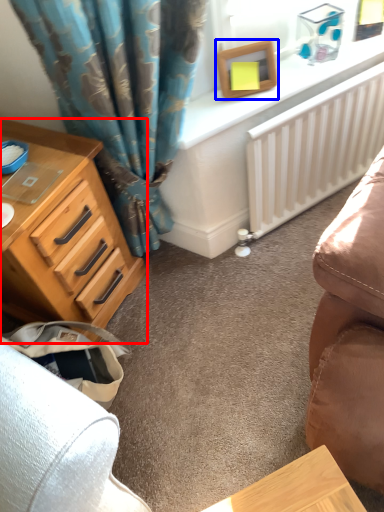
Question: Which object is closer to the camera taking this photo, chest of drawers (highlighted by a red box) or picture frame (highlighted by a blue box)?

Choices:
 (A) chest of drawers
 (B) picture frame

Answer: (A)